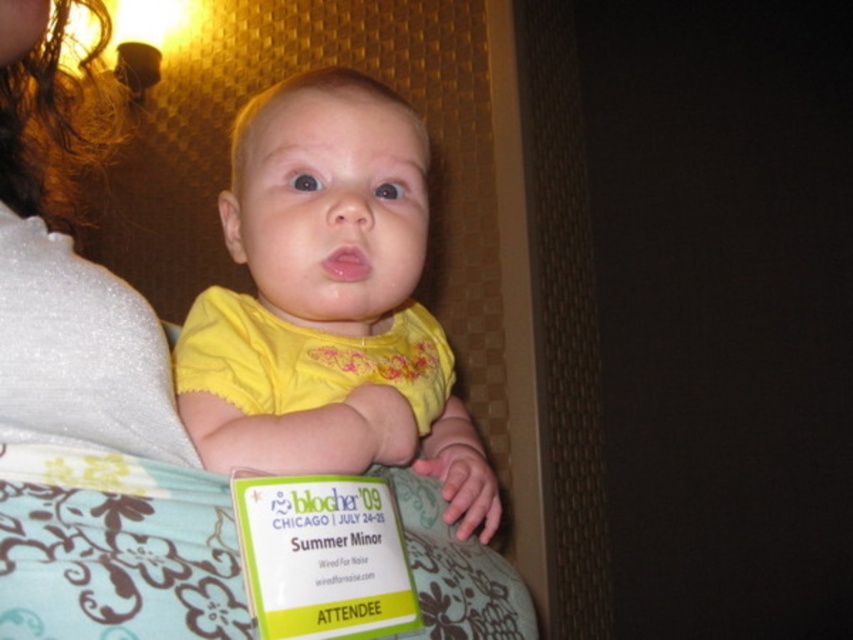
Question: Is yellow fabric baby at center to the left of white sparkly fabric at upper left from the viewer's perspective?

Choices:
 (A) no
 (B) yes

Answer: (A)

Question: Which of the following is the farthest from the observer?

Choices:
 (A) (68, 588)
 (B) (289, 412)

Answer: (B)

Question: Which point is farther to the camera?

Choices:
 (A) white sparkly fabric at upper left
 (B) yellow fabric baby at center

Answer: (B)

Question: Does yellow fabric baby at center come in front of white sparkly fabric at upper left?

Choices:
 (A) yes
 (B) no

Answer: (B)

Question: Among these objects, which one is farthest from the camera?

Choices:
 (A) yellow fabric baby at center
 (B) white sparkly fabric at upper left

Answer: (A)

Question: Can you confirm if yellow fabric baby at center is thinner than white sparkly fabric at upper left?

Choices:
 (A) yes
 (B) no

Answer: (A)